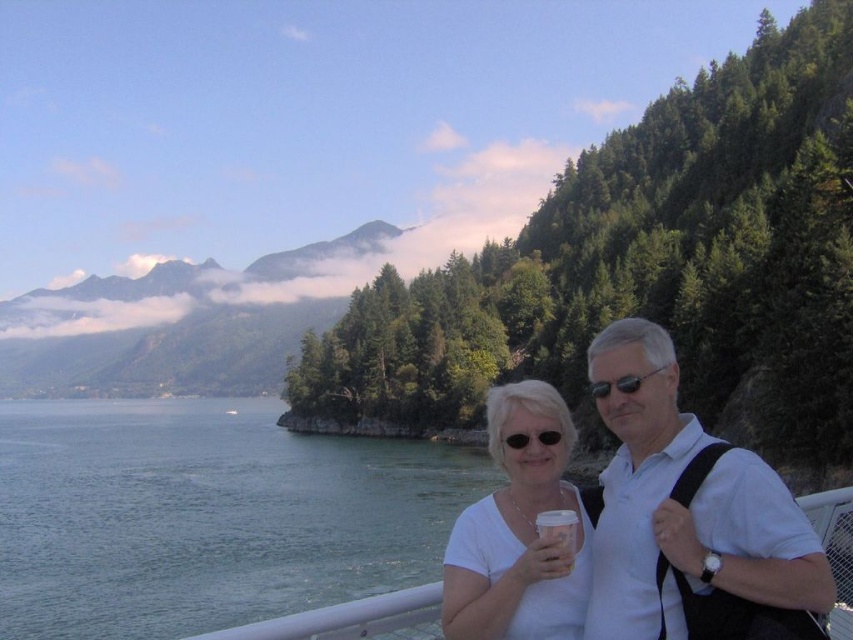
You are standing at the origin point in the image. Which of the two points, point (761,552) or point (566,570), is closer to you?

Point (761,552) is in front of point (566,570), so it is closer to you.

You are a photographer trying to capture a photo of the white matte shirt at center and the white paper cup at center. Which object should you focus on first if you want to ensure both are in sharp focus?

The white matte shirt at center is taller than the white paper cup at center, so focusing on the white matte shirt at center first will ensure both are in sharp focus as it is the larger object.